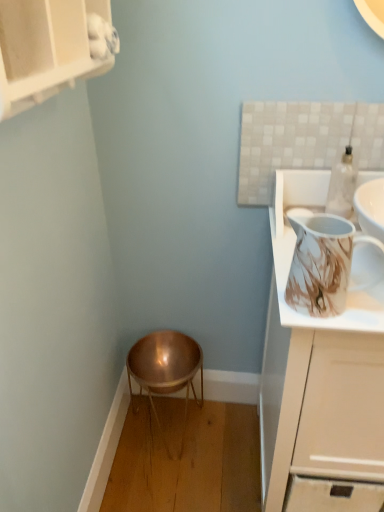
Question: Is copper metallic stool at lower center inside the boundaries of marble-patterned pitcher at upper right, or outside?

Choices:
 (A) inside
 (B) outside

Answer: (B)

Question: In the image, is copper metallic stool at lower center positioned in front of or behind marble-patterned pitcher at upper right?

Choices:
 (A) behind
 (B) front

Answer: (A)

Question: Considering the real-world distances, which object is closest to the matte white cabinet at upper left, which is the second cabinetry from bottom to top?

Choices:
 (A) white glossy cabinet at upper right, which is the first cabinetry in right-to-left order
 (B) copper metallic stool at lower center
 (C) marble-patterned pitcher at upper right

Answer: (C)

Question: Which of these objects is positioned closest to the copper metallic stool at lower center?

Choices:
 (A) matte white cabinet at upper left, which is the second cabinetry from bottom to top
 (B) white glossy cabinet at upper right, arranged as the 2th cabinetry when viewed from the top
 (C) marble-patterned pitcher at upper right

Answer: (B)